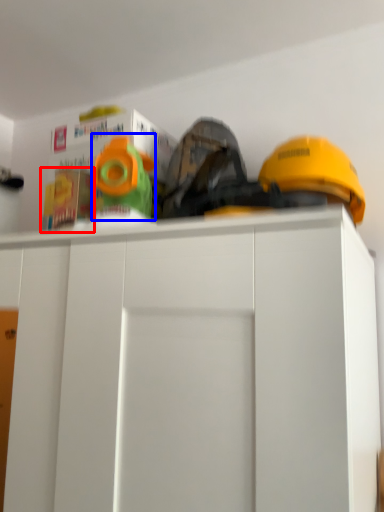
Question: Which of the following is the closest to the observer, toy (highlighted by a red box) or toy (highlighted by a blue box)?

Choices:
 (A) toy
 (B) toy

Answer: (B)